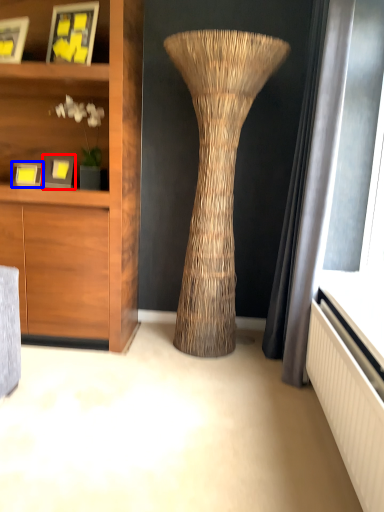
Question: Which object appears farthest to the camera in this image, picture frame (highlighted by a red box) or picture frame (highlighted by a blue box)?

Choices:
 (A) picture frame
 (B) picture frame

Answer: (B)